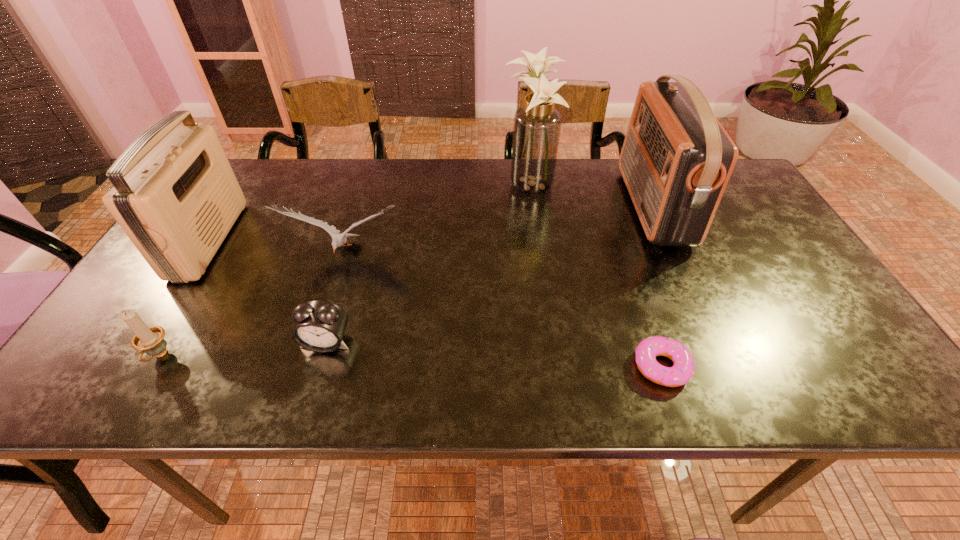
Where is `candle_holder that is at the left edge`? This screenshot has width=960, height=540. candle_holder that is at the left edge is located at coordinates (150, 340).

Locate an element on the screen. This screenshot has height=540, width=960. object present at the far left corner is located at coordinates (175, 195).

Find the location of `object located at the near left corner`. object located at the near left corner is located at coordinates (150, 340).

In the image, there is a desktop. Identify the location of vacant area at the far edge. (325, 176).

At what (x,y) coordinates should I click in order to perform the action: click on free spot at the near edge of the desktop. Please return your answer as a coordinate pair (x, y). The width and height of the screenshot is (960, 540). Looking at the image, I should click on [x=384, y=386].

Identify the location of free region at the left edge of the desktop. (213, 265).

The height and width of the screenshot is (540, 960). Find the location of `vacant space at the right edge`. vacant space at the right edge is located at coordinates (732, 230).

Find the location of a particular element. vacant space at the far left corner of the desktop is located at coordinates (278, 168).

The width and height of the screenshot is (960, 540). In order to click on vacant position at the near left corner of the desktop in this screenshot , I will do `click(75, 379)`.

In the image, there is a desktop. Where is `vacant area at the far right corner`? The height and width of the screenshot is (540, 960). vacant area at the far right corner is located at coordinates (733, 179).